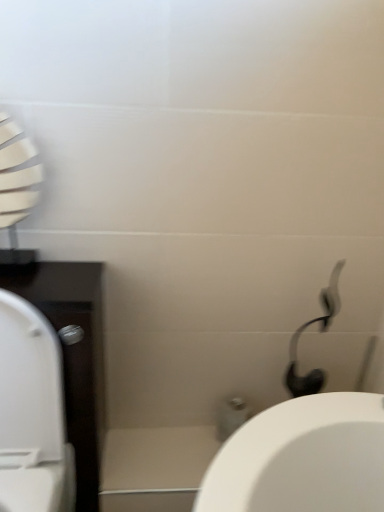
Question: Is there a large distance between white glossy porcelain at center and white glossy toilet at left?

Choices:
 (A) yes
 (B) no

Answer: (B)

Question: Does white glossy porcelain at center have a greater height compared to white glossy toilet at left?

Choices:
 (A) no
 (B) yes

Answer: (A)

Question: Is white glossy porcelain at center further to the viewer compared to white glossy toilet at left?

Choices:
 (A) no
 (B) yes

Answer: (B)

Question: Does white glossy porcelain at center lie in front of white glossy toilet at left?

Choices:
 (A) yes
 (B) no

Answer: (B)

Question: Could you tell me if white glossy porcelain at center is turned towards white glossy toilet at left?

Choices:
 (A) no
 (B) yes

Answer: (A)

Question: Based on their sizes in the image, would you say white matte shower head at upper right is bigger or smaller than white glossy toilet at left?

Choices:
 (A) small
 (B) big

Answer: (A)

Question: From the image's perspective, is white matte shower head at upper right above or below white glossy toilet at left?

Choices:
 (A) above
 (B) below

Answer: (A)

Question: From a real-world perspective, is white matte shower head at upper right above or below white glossy toilet at left?

Choices:
 (A) above
 (B) below

Answer: (A)

Question: Is white matte shower head at upper right taller or shorter than white glossy toilet at left?

Choices:
 (A) short
 (B) tall

Answer: (A)

Question: From the image's perspective, is white glossy toilet at left above or below white matte shower head at upper right?

Choices:
 (A) below
 (B) above

Answer: (A)

Question: From a real-world perspective, relative to white matte shower head at upper right, is white glossy toilet at left vertically above or below?

Choices:
 (A) above
 (B) below

Answer: (B)

Question: Is white glossy toilet at left bigger or smaller than white matte shower head at upper right?

Choices:
 (A) big
 (B) small

Answer: (A)

Question: In terms of width, does white glossy toilet at left look wider or thinner when compared to white matte shower head at upper right?

Choices:
 (A) wide
 (B) thin

Answer: (A)

Question: Do you think white matte shower head at upper right is within white glossy porcelain at center, or outside of it?

Choices:
 (A) outside
 (B) inside

Answer: (A)

Question: Considering the positions of white matte shower head at upper right and white glossy porcelain at center in the image, is white matte shower head at upper right wider or thinner than white glossy porcelain at center?

Choices:
 (A) thin
 (B) wide

Answer: (A)